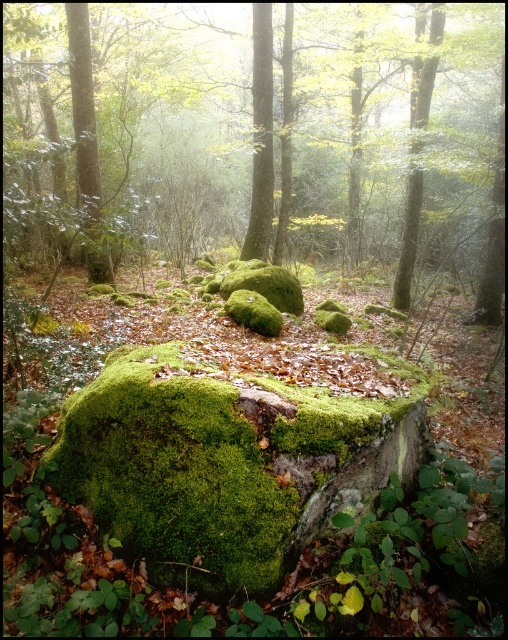
Between green mossy rock at left and green mossy tree trunk at center, which one is positioned lower?

Positioned lower is green mossy rock at left.

Who is higher up, green mossy rock at left or green mossy tree trunk at center?

Positioned higher is green mossy tree trunk at center.

Where is `green mossy rock at left`? This screenshot has height=640, width=508. green mossy rock at left is located at coordinates (86, 141).

You are a GUI agent. You are given a task and a screenshot of the screen. Output one action in this format:
    pyautogui.click(x=<x>, y=<y>)
    Task: Click on the green mossy rock at left
    The height and width of the screenshot is (640, 508).
    Given the screenshot: What is the action you would take?
    pyautogui.click(x=86, y=141)

Is green mossy rock at center above green mossy rock at left?

Correct, green mossy rock at center is located above green mossy rock at left.

Can you confirm if green mossy rock at center is positioned to the left of green mossy rock at left?

In fact, green mossy rock at center is to the right of green mossy rock at left.

I want to click on green mossy rock at center, so click(x=263, y=136).

Who is more distant from viewer, (268, 38) or (418, 147)?

The point (268, 38) is more distant.

Which is below, green mossy tree trunk at center or smooth bark tree at upper right?

green mossy tree trunk at center is below.

Which is in front, point (268, 131) or point (417, 88)?

Point (268, 131) is in front.

Locate an element on the screen. The height and width of the screenshot is (640, 508). green mossy tree trunk at center is located at coordinates (261, 138).